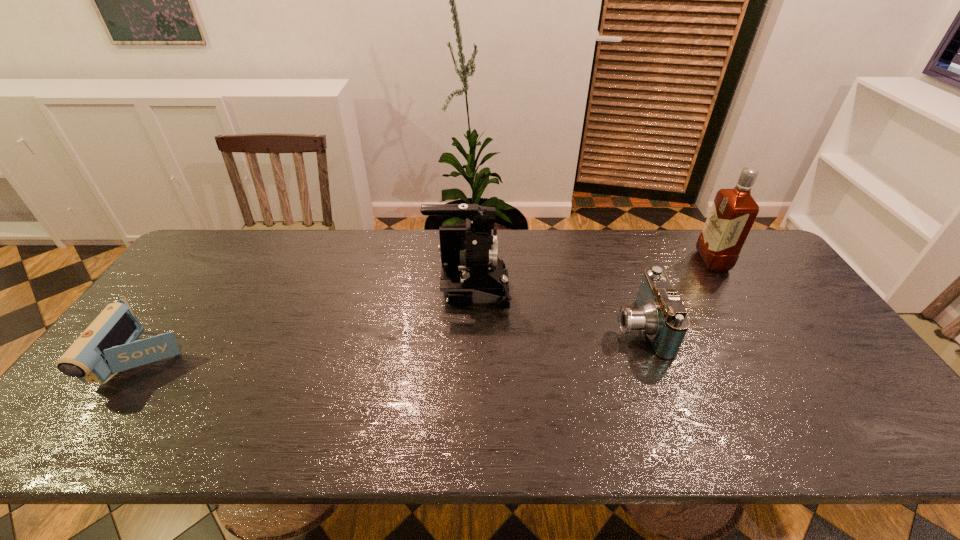
This screenshot has height=540, width=960. Find the location of `free area in between the liquor and the second object from left to right`. free area in between the liquor and the second object from left to right is located at coordinates (590, 275).

Where is `free space between the second object from left to right and the leftmost camcorder`? The width and height of the screenshot is (960, 540). free space between the second object from left to right and the leftmost camcorder is located at coordinates (307, 325).

This screenshot has height=540, width=960. In order to click on object identified as the third closest to the second object from right to left in this screenshot , I will do `click(109, 345)`.

Where is `object that is the nearest to the liquor`? object that is the nearest to the liquor is located at coordinates (660, 314).

Choose which camcorder is the third nearest neighbor to the liquor. Please provide its 2D coordinates. Your answer should be formatted as a tuple, i.e. [(x, y)], where the tuple contains the x and y coordinates of a point satisfying the conditions above.

[(109, 345)]

This screenshot has width=960, height=540. What are the coordinates of `the closest camcorder to the rightmost object` in the screenshot? It's located at (660, 314).

Find the location of a particular element. The height and width of the screenshot is (540, 960). free space that satisfies the following two spatial constraints: 1. on the front label of the rightmost object; 2. on the side of the leftmost camcorder with the flip-out screen is located at coordinates (775, 360).